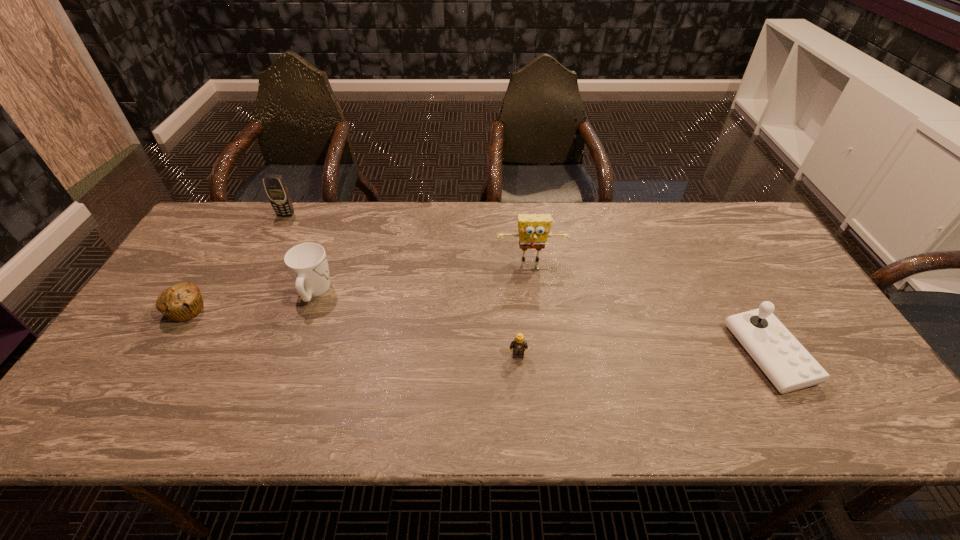
Find the location of a particular element. vacant area between the muffin and the Lego is located at coordinates coord(352,333).

Where is `vacant region between the rightmost object and the second farthest object`? This screenshot has width=960, height=540. vacant region between the rightmost object and the second farthest object is located at coordinates (650, 307).

Find the location of a particular element. free spot between the cellular telephone and the rightmost object is located at coordinates (527, 285).

I want to click on empty space that is in between the fifth nearest object and the cellular telephone, so click(409, 238).

Locate an element on the screen. The height and width of the screenshot is (540, 960). vacant space that's between the rightmost object and the cellular telephone is located at coordinates (527, 285).

Image resolution: width=960 pixels, height=540 pixels. I want to click on free space between the joystick and the mug, so click(x=541, y=323).

Locate which object ranks second in proximity to the leftmost object. Please provide its 2D coordinates. Your answer should be formatted as a tuple, i.e. [(x, y)], where the tuple contains the x and y coordinates of a point satisfying the conditions above.

[(277, 191)]

Identify which object is the fifth nearest to the Lego. Please provide its 2D coordinates. Your answer should be formatted as a tuple, i.e. [(x, y)], where the tuple contains the x and y coordinates of a point satisfying the conditions above.

[(277, 191)]